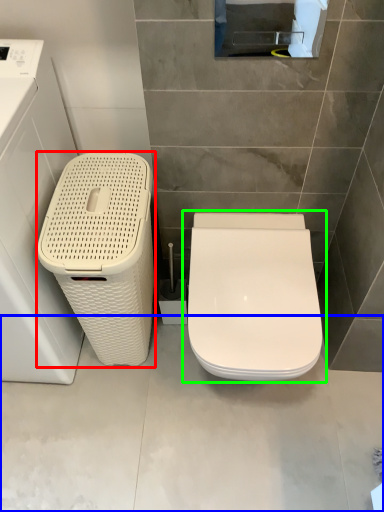
Question: Estimate the real-world distances between objects in this image. Which object is closer to dish washer (highlighted by a red box), concrete (highlighted by a blue box) or toilet (highlighted by a green box)?

Choices:
 (A) concrete
 (B) toilet

Answer: (B)